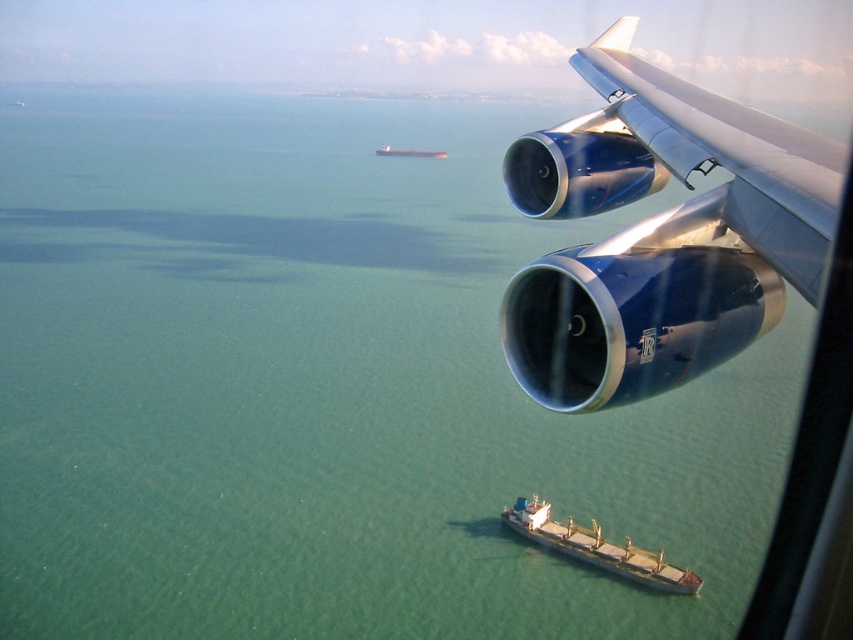
Question: Observing the image, what is the correct spatial positioning of blue metallic engine at upper right in reference to metallic gray ship at center?

Choices:
 (A) above
 (B) below

Answer: (B)

Question: Considering the relative positions of metallic gray ship at lower center and metallic gray ship at center in the image provided, where is metallic gray ship at lower center located with respect to metallic gray ship at center?

Choices:
 (A) above
 (B) below

Answer: (B)

Question: Which point is farther to the camera?

Choices:
 (A) metallic gray ship at center
 (B) blue metallic engine at upper right
 (C) metallic gray ship at lower center

Answer: (A)

Question: Which point is closer to the camera?

Choices:
 (A) metallic gray ship at lower center
 (B) blue metallic engine at upper right

Answer: (B)

Question: Is blue metallic engine at upper right smaller than metallic gray ship at center?

Choices:
 (A) no
 (B) yes

Answer: (B)

Question: Which object is farther from the camera taking this photo?

Choices:
 (A) metallic gray ship at center
 (B) blue metallic engine at upper right

Answer: (A)